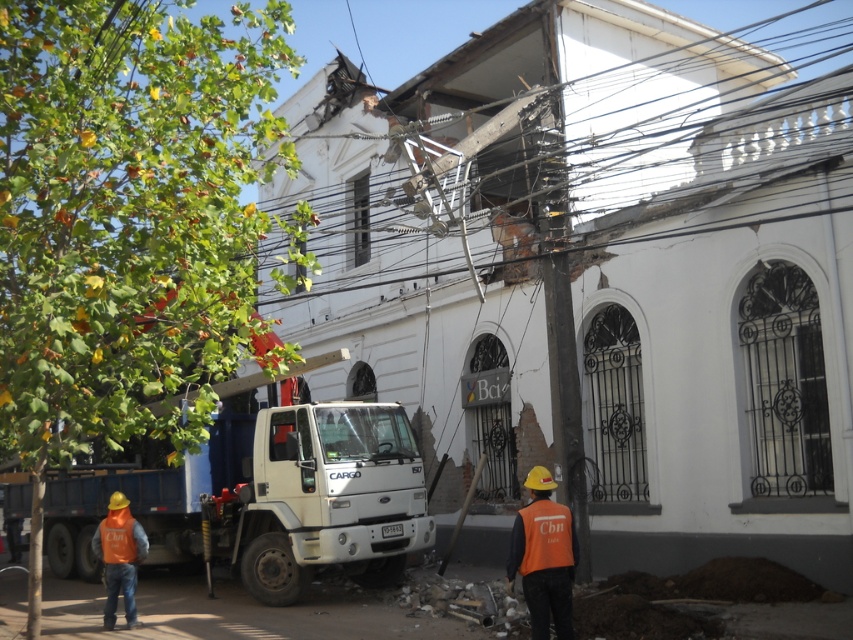
Which is below, metallic wires at upper center or orange reflective vest at lower left?

orange reflective vest at lower left is lower down.

Which is above, metallic wires at upper center or orange reflective vest at lower left?

metallic wires at upper center

Which is in front, point (621, 122) or point (129, 529)?

Point (129, 529) is in front.

Where is `metallic wires at upper center`? Image resolution: width=853 pixels, height=640 pixels. metallic wires at upper center is located at coordinates (677, 92).

Which is more to the right, white matte truck at center or metallic wires at upper center?

From the viewer's perspective, metallic wires at upper center appears more on the right side.

Which of these two, white matte truck at center or metallic wires at upper center, stands taller?

metallic wires at upper center is taller.

Where is `white matte truck at center`? white matte truck at center is located at coordinates (277, 500).

Does metallic wires at upper center have a greater width compared to orange reflective safety vest at lower center?

Yes, metallic wires at upper center is wider than orange reflective safety vest at lower center.

Is metallic wires at upper center smaller than orange reflective safety vest at lower center?

No.

You are a GUI agent. You are given a task and a screenshot of the screen. Output one action in this format:
    pyautogui.click(x=<x>, y=<y>)
    Task: Click on the metallic wires at upper center
    The height and width of the screenshot is (640, 853).
    Given the screenshot: What is the action you would take?
    pyautogui.click(x=677, y=92)

Locate an element on the screen. metallic wires at upper center is located at coordinates (677, 92).